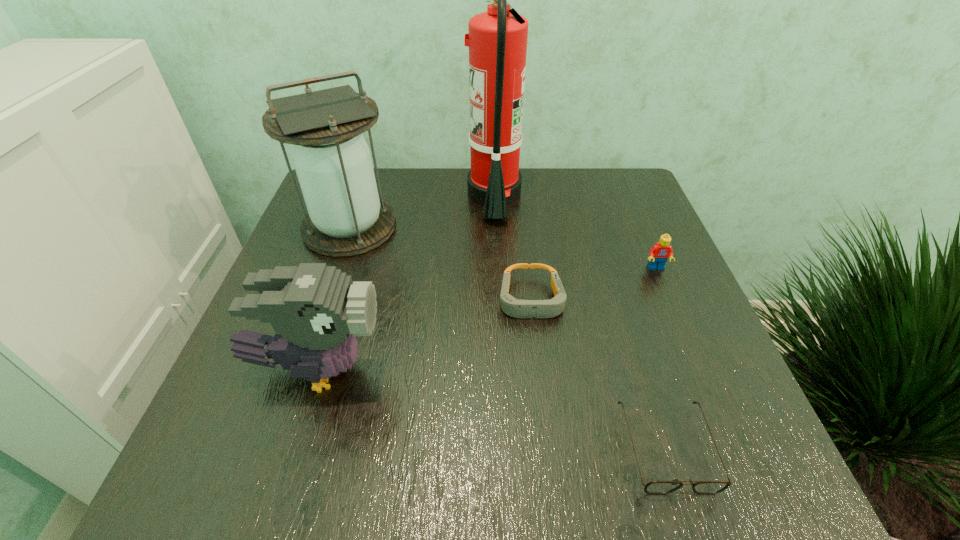
In the image, there is a desktop. Find the location of `free space at the near right corner`. free space at the near right corner is located at coordinates (693, 438).

You are a GUI agent. You are given a task and a screenshot of the screen. Output one action in this format:
    pyautogui.click(x=<x>, y=<y>)
    Task: Click on the empty space between the sunglasses and the goggles
    The width and height of the screenshot is (960, 540).
    Given the screenshot: What is the action you would take?
    pyautogui.click(x=599, y=373)

This screenshot has width=960, height=540. Find the location of `vacant space that's between the sunglasses and the Lego`. vacant space that's between the sunglasses and the Lego is located at coordinates (661, 357).

At what (x,y) coordinates should I click in order to perform the action: click on free space between the fifth shortest object and the tallest object. Please return your answer as a coordinate pair (x, y). The image size is (960, 540). Looking at the image, I should click on 422,211.

The height and width of the screenshot is (540, 960). Find the location of `vacant space that's between the third nearest object and the second tallest object`. vacant space that's between the third nearest object and the second tallest object is located at coordinates (441, 263).

The image size is (960, 540). What are the coordinates of `free space between the lantern and the third nearest object` in the screenshot? It's located at (441, 263).

I want to click on empty space between the tallest object and the lantern, so click(x=422, y=211).

Where is `vacant area that lies between the fourth farthest object and the rightmost object`? vacant area that lies between the fourth farthest object and the rightmost object is located at coordinates pos(593,284).

Identify the location of vacant region between the fire extinguisher and the second object from right to left. The width and height of the screenshot is (960, 540). (581, 321).

Locate an element on the screen. free space between the fire extinguisher and the third nearest object is located at coordinates (513, 247).